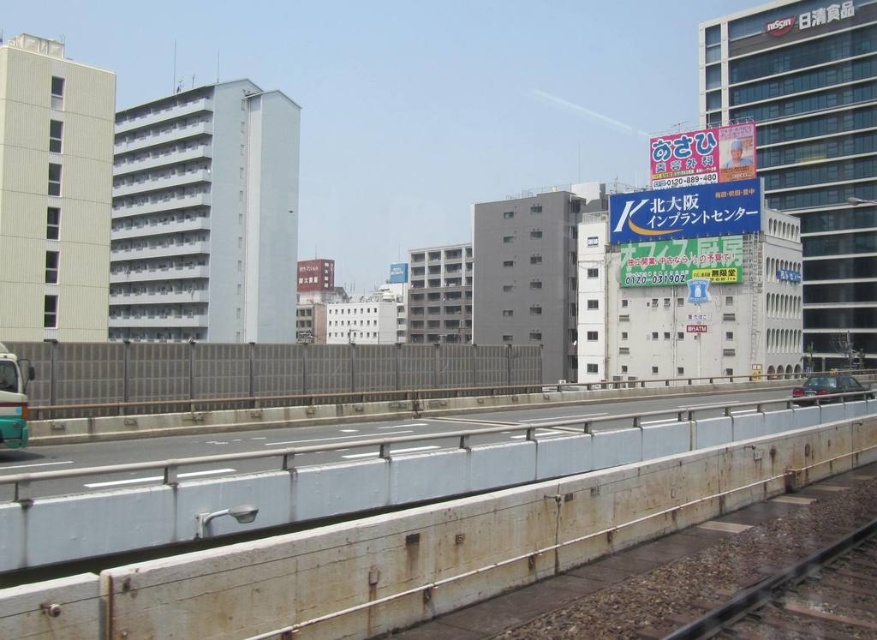
Consider the image. You are a delivery drone flying above the urban scene. You need to deliver a package to the brown wooden train track at lower right, but there is a metallic silver car at right nearby. Considering their heights, can you safely descend to the train track without hitting the car?

The brown wooden train track at lower right has a lesser height compared to the metallic silver car at right. Since the train track is shorter, the drone can safely descend to it without hitting the car.